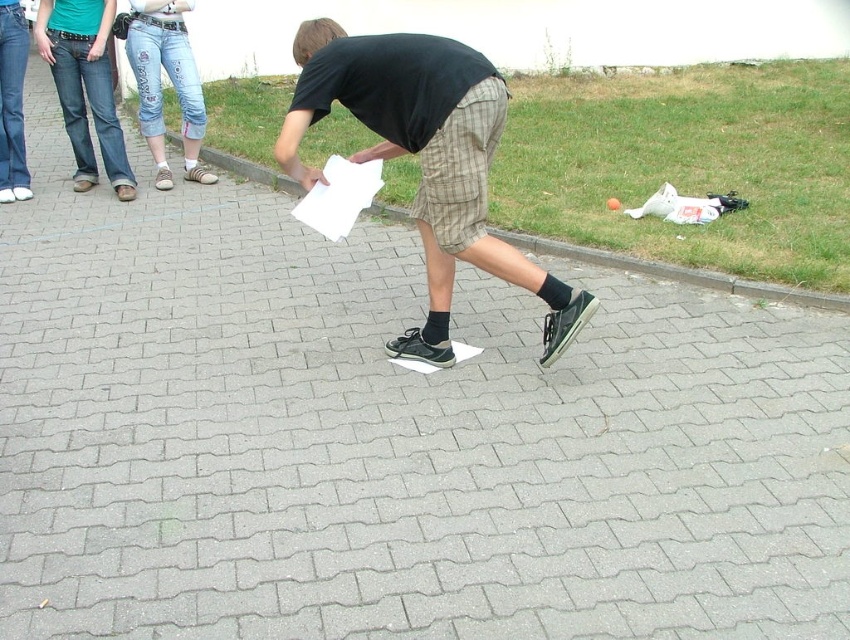
You are a photographer trying to capture the scene where the person is interacting with the paper. Based on the height comparison between the black matte shirt at center and the gray concrete curb at center, which object would appear larger in your photo?

The black matte shirt at center appears larger in the photo because it is taller than the gray concrete curb at center.

Looking at this image, you are a photographer trying to capture a closeup of the black matte shirt at center and denim jeans at upper left. Since you want both to be clearly visible, which one should you zoom in on more?

The black matte shirt at center is bigger than the denim jeans at upper left, so you should zoom in more on the denim jeans at upper left to ensure both are clearly visible.

You are a photographer trying to capture the person bending down to pick up the paper. Based on the scene, is the black matte shirt at center visible above or below the gray concrete curb at center in your photo?

The black matte shirt at center is below the gray concrete curb at center, so it will be visible below the curb in the photo.